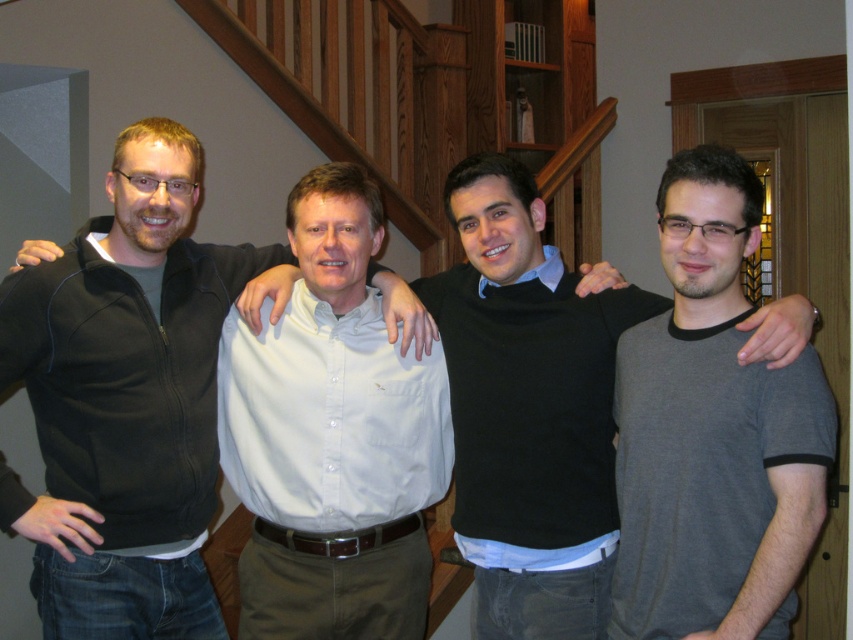
From the picture: Does gray cotton t-shirt at right appear on the left side of black sweater at center?

No, gray cotton t-shirt at right is not to the left of black sweater at center.

Is gray cotton t-shirt at right further to the viewer compared to black sweater at center?

No, gray cotton t-shirt at right is closer to the viewer.

Does point (668, 506) lie in front of point (488, 588)?

Yes, it is in front of point (488, 588).

In order to click on gray cotton t-shirt at right in this screenshot , I will do `click(712, 433)`.

Between white shirt at center and black sweater at center, which one has more height?

Standing taller between the two is black sweater at center.

Is white shirt at center to the right of black sweater at center from the viewer's perspective?

No, white shirt at center is not to the right of black sweater at center.

Find the location of `white shirt at center`. white shirt at center is located at coordinates (332, 436).

Is black zip-up jacket at left closer to camera compared to black sweater at center?

Yes.

Does point (155, 172) come closer to viewer compared to point (537, 406)?

Yes, point (155, 172) is closer to viewer.

You are a GUI agent. You are given a task and a screenshot of the screen. Output one action in this format:
    pyautogui.click(x=<x>, y=<y>)
    Task: Click on the black zip-up jacket at left
    The width and height of the screenshot is (853, 640).
    Given the screenshot: What is the action you would take?
    pyautogui.click(x=128, y=400)